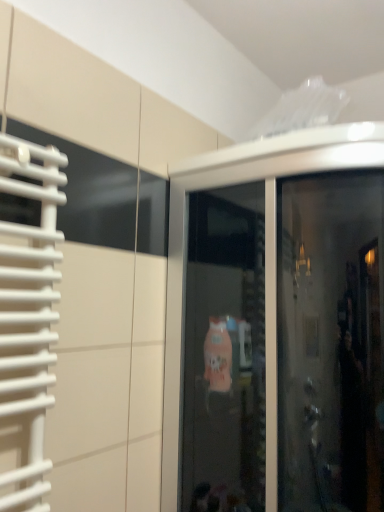
What do you see at coordinates (287, 346) in the screenshot?
I see `transparent glass screen door at upper center` at bounding box center [287, 346].

Where is `transparent glass screen door at upper center`? The image size is (384, 512). transparent glass screen door at upper center is located at coordinates (287, 346).

This screenshot has width=384, height=512. I want to click on transparent glass screen door at upper center, so click(287, 346).